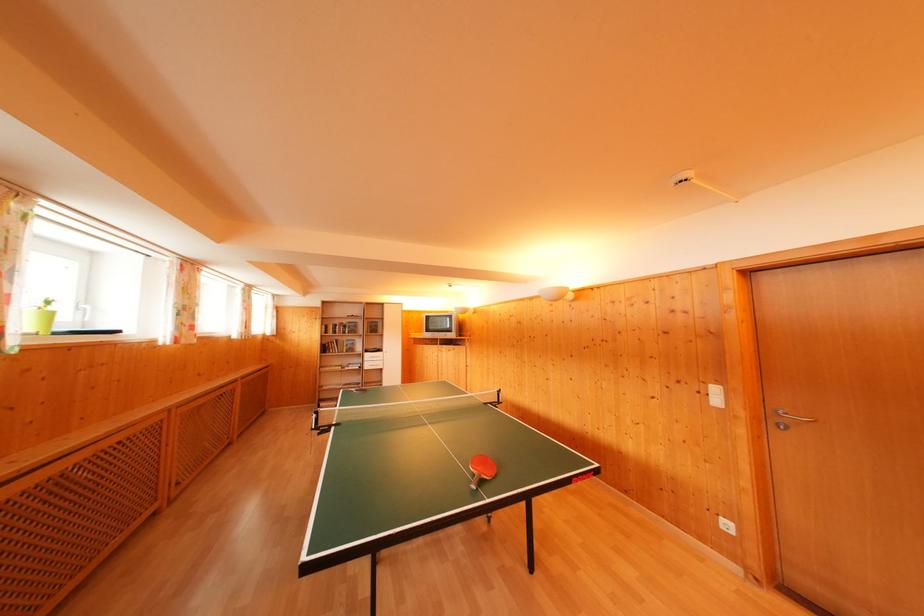
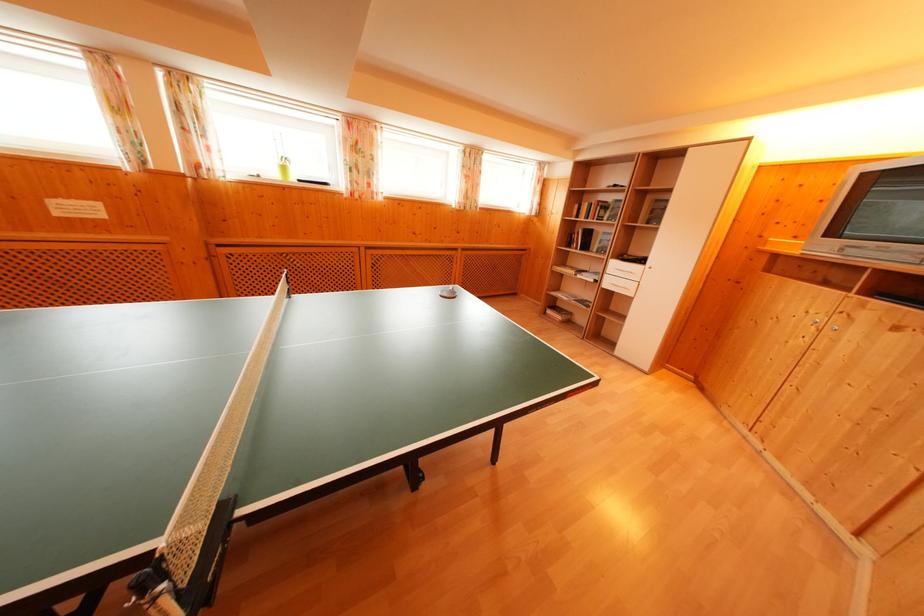
The point at (55, 321) is marked in the first image. Where is the corresponding point in the second image?

(288, 174)